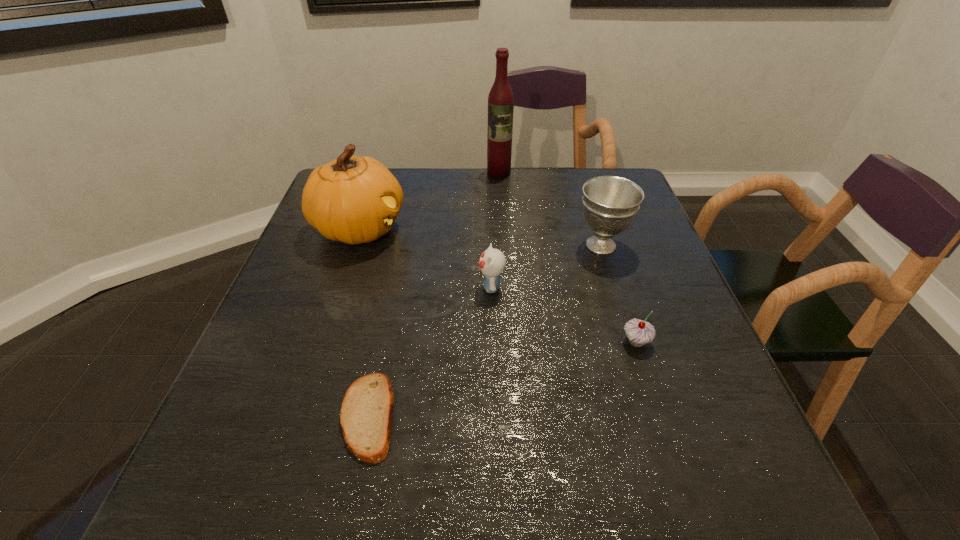
Identify the location of free space located on the label of the tallest object. The height and width of the screenshot is (540, 960). (504, 261).

At what (x,y) coordinates should I click in order to perform the action: click on vacant space located 0.240m on the front face of the pumpkin. Please return your answer as a coordinate pair (x, y). The height and width of the screenshot is (540, 960). Looking at the image, I should click on (496, 228).

Find the location of a particular element. free spot located on the right of the chalice is located at coordinates (660, 245).

This screenshot has height=540, width=960. I want to click on free point located 0.380m on the front-facing side of the third shortest object, so click(x=313, y=287).

The width and height of the screenshot is (960, 540). Identify the location of vacant space located 0.080m on the front-facing side of the third shortest object. (443, 287).

The height and width of the screenshot is (540, 960). I want to click on vacant space situated on the front-facing side of the third shortest object, so click(x=339, y=287).

Where is `blank space located 0.180m on the front of the cupcake`? blank space located 0.180m on the front of the cupcake is located at coordinates (668, 439).

Locate an element on the screen. This screenshot has height=540, width=960. vacant area located on the left of the nearest object is located at coordinates (312, 416).

The height and width of the screenshot is (540, 960). What are the coordinates of `liquor present at the far edge` in the screenshot? It's located at (500, 99).

At what (x,y) coordinates should I click in order to perform the action: click on pumpkin positioned at the far edge. Please return your answer as a coordinate pair (x, y). Looking at the image, I should click on (354, 199).